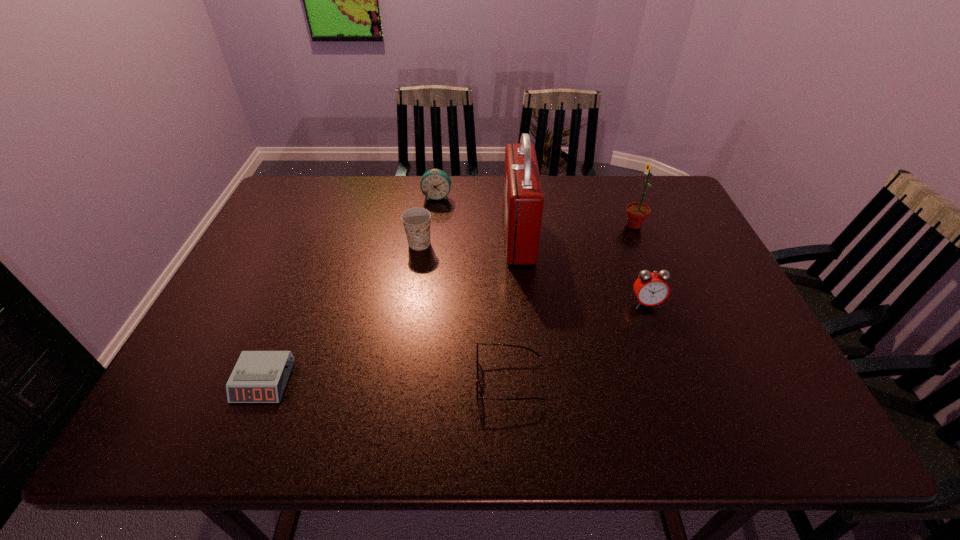
The image size is (960, 540). I want to click on blank space located 0.230m on the face of the spectacles, so click(367, 380).

Image resolution: width=960 pixels, height=540 pixels. I want to click on vacant space located on the face of the spectacles, so click(329, 380).

Identify the location of vacant position located on the back of the shortest object. (314, 258).

Image resolution: width=960 pixels, height=540 pixels. Find the location of `the first-aid kit that is at the far edge`. the first-aid kit that is at the far edge is located at coordinates (523, 199).

You are a GUI agent. You are given a task and a screenshot of the screen. Output one action in this format:
    pyautogui.click(x=<x>, y=<y>)
    Task: Click on the alarm clock that is at the far edge
    This screenshot has width=960, height=540.
    Given the screenshot: What is the action you would take?
    pyautogui.click(x=435, y=184)

Where is `spectacles at the near edge`? spectacles at the near edge is located at coordinates (477, 376).

Locate an element on the screen. The width and height of the screenshot is (960, 540). alarm clock that is at the near edge is located at coordinates (259, 376).

Identify the location of object at the left edge. The height and width of the screenshot is (540, 960). (259, 376).

Find the location of a particular element. This screenshot has width=960, height=540. object at the right edge is located at coordinates (637, 213).

The width and height of the screenshot is (960, 540). Find the location of `object positioned at the near left corner`. object positioned at the near left corner is located at coordinates (259, 376).